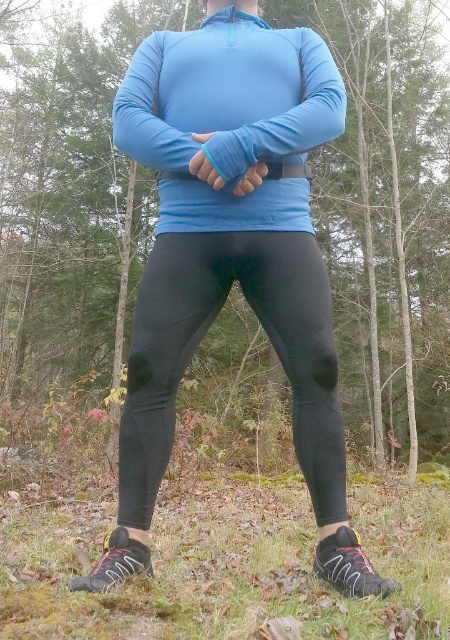
Is matte black leggings at center closer to the viewer compared to black matte leggings at center?

No, matte black leggings at center is behind black matte leggings at center.

Which is behind, point (350, 140) or point (328, 394)?

The point (350, 140) is more distant.

Identify the location of matte black leggings at center. This screenshot has height=640, width=450. (70, 212).

Does matte blue long-sleeve shirt at center have a larger size compared to black matte leggings at center?

Correct, matte blue long-sleeve shirt at center is larger in size than black matte leggings at center.

Does matte blue long-sleeve shirt at center appear on the left side of black matte leggings at center?

No, matte blue long-sleeve shirt at center is not to the left of black matte leggings at center.

Which is in front, point (259, 157) or point (167, 419)?

Point (259, 157)

In order to click on matte blue long-sleeve shirt at center in this screenshot , I will do `click(229, 118)`.

Can you confirm if matte black leggings at center is positioned above matte blue long-sleeve shirt at center?

Correct, matte black leggings at center is located above matte blue long-sleeve shirt at center.

Is the position of matte black leggings at center less distant than that of matte blue long-sleeve shirt at center?

That is False.

Is point (144, 10) closer to camera compared to point (279, 81)?

No, (144, 10) is behind (279, 81).

Where is `matte black leggings at center`? Image resolution: width=450 pixels, height=640 pixels. matte black leggings at center is located at coordinates (70, 212).